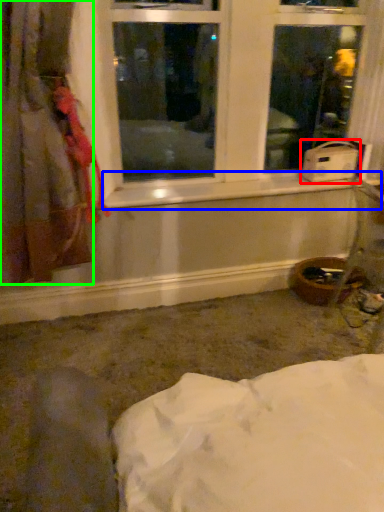
Question: Based on their relative distances, which object is farther from water heater (highlighted by a red box)? Choose from window sill (highlighted by a blue box) and curtain (highlighted by a green box).

Choices:
 (A) window sill
 (B) curtain

Answer: (B)